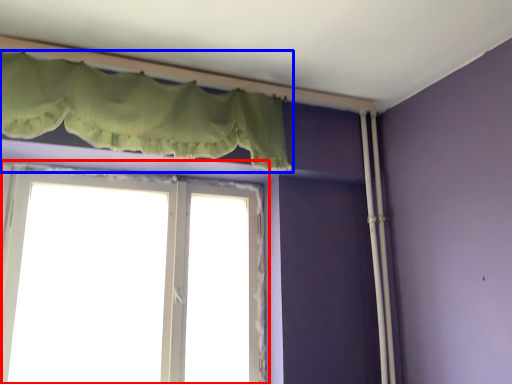
Question: Which object is closer to the camera taking this photo, window (highlighted by a red box) or curtain (highlighted by a blue box)?

Choices:
 (A) window
 (B) curtain

Answer: (B)